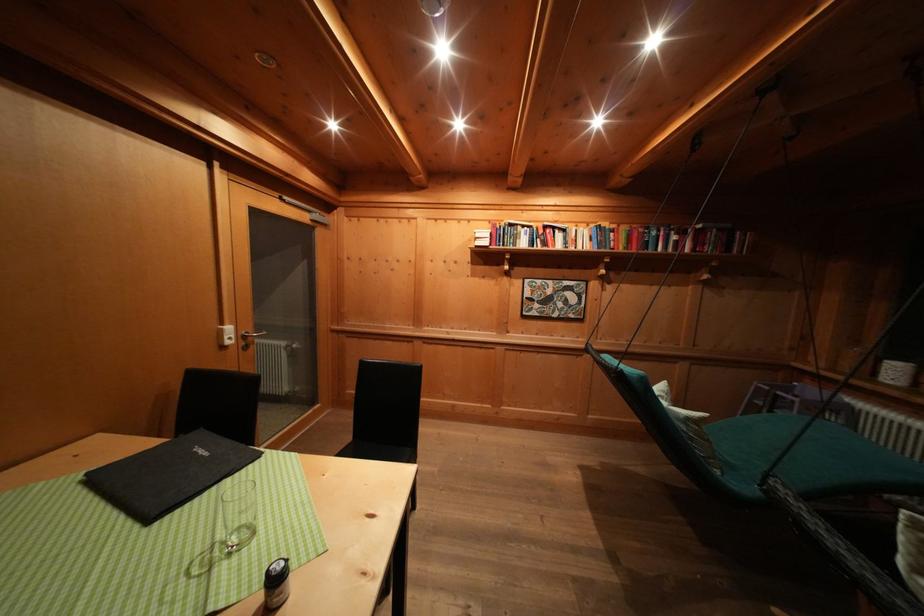
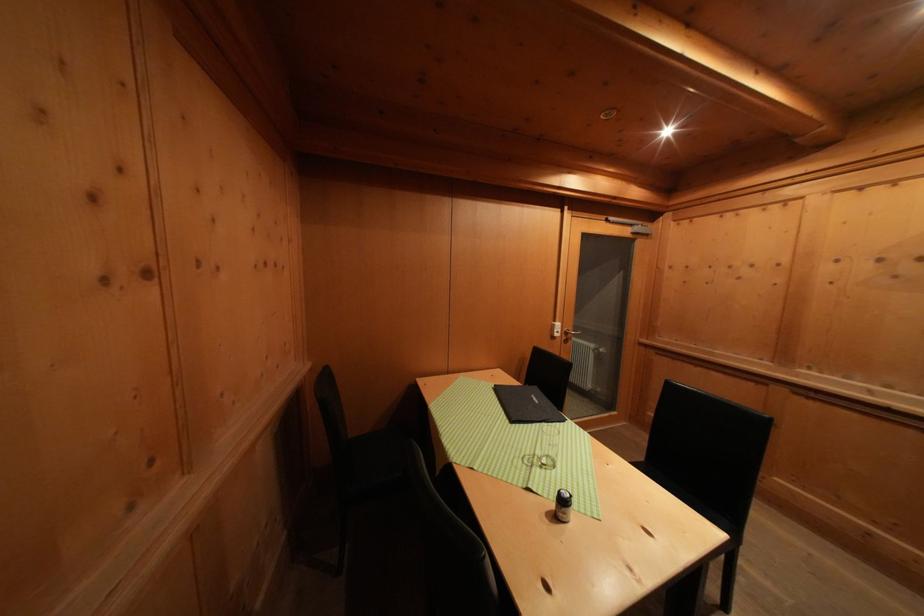
In the second image, find the point that corresponds to (x=236, y=333) in the first image.

(564, 330)